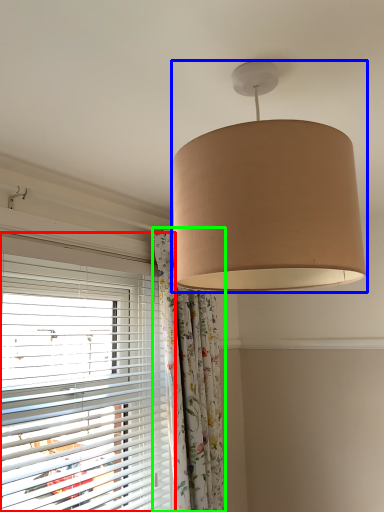
Question: Considering the real-world distances, which object is closest to window blind (highlighted by a red box)? lamp (highlighted by a blue box) or curtain (highlighted by a green box).

Choices:
 (A) lamp
 (B) curtain

Answer: (B)